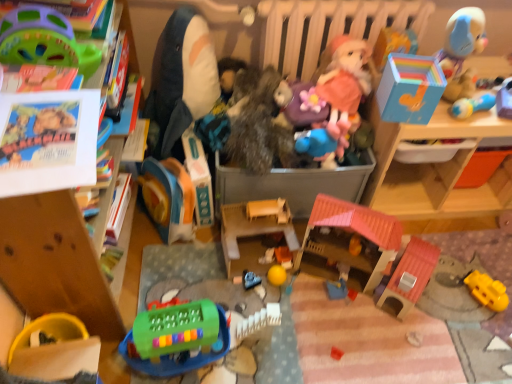
Locate an element on the screen. This screenshot has width=512, height=384. vacant area that lies to the right of yellow rubber ball at center, acting as the eighth toy starting from the right is located at coordinates (311, 283).